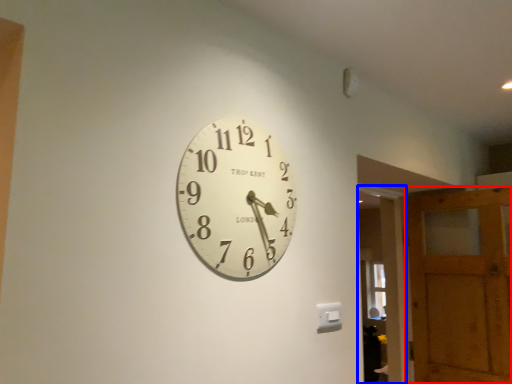
Question: Which point is closer to the camera, barn door (highlighted by a red box) or glass door (highlighted by a blue box)?

Choices:
 (A) barn door
 (B) glass door

Answer: (A)